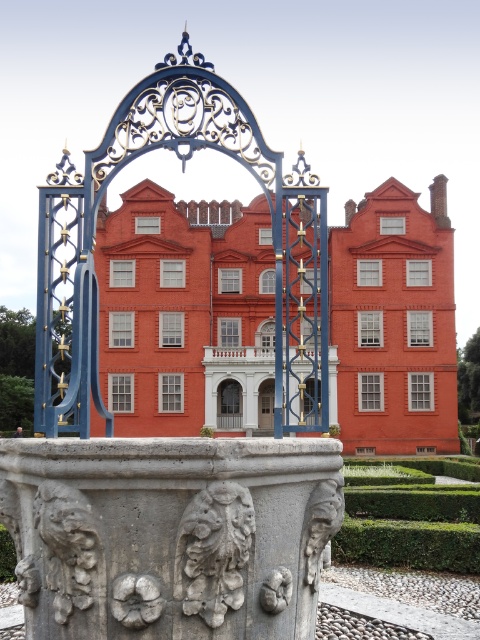
Question: Can you confirm if smooth brick palace at center is smaller than gray stone pillar at center?

Choices:
 (A) no
 (B) yes

Answer: (A)

Question: Which point appears closest to the camera in this image?

Choices:
 (A) (153, 490)
 (B) (217, 403)
 (C) (236, 529)
 (D) (225, 355)

Answer: (A)

Question: Which of the following is the closest to the observer?

Choices:
 (A) pyautogui.click(x=233, y=422)
 (B) pyautogui.click(x=32, y=490)
 (C) pyautogui.click(x=180, y=276)
 (D) pyautogui.click(x=202, y=564)

Answer: (D)

Question: Is smooth brick palace at center closer to camera compared to green leafy hedge at lower right?

Choices:
 (A) yes
 (B) no

Answer: (B)

Question: Which point appears farthest from the camera in this image?

Choices:
 (A) (235, 545)
 (B) (478, 528)
 (C) (235, 403)
 (D) (243, 397)

Answer: (C)

Question: Does green leafy hedge at lower right lie in front of white stone carving at center?

Choices:
 (A) no
 (B) yes

Answer: (A)